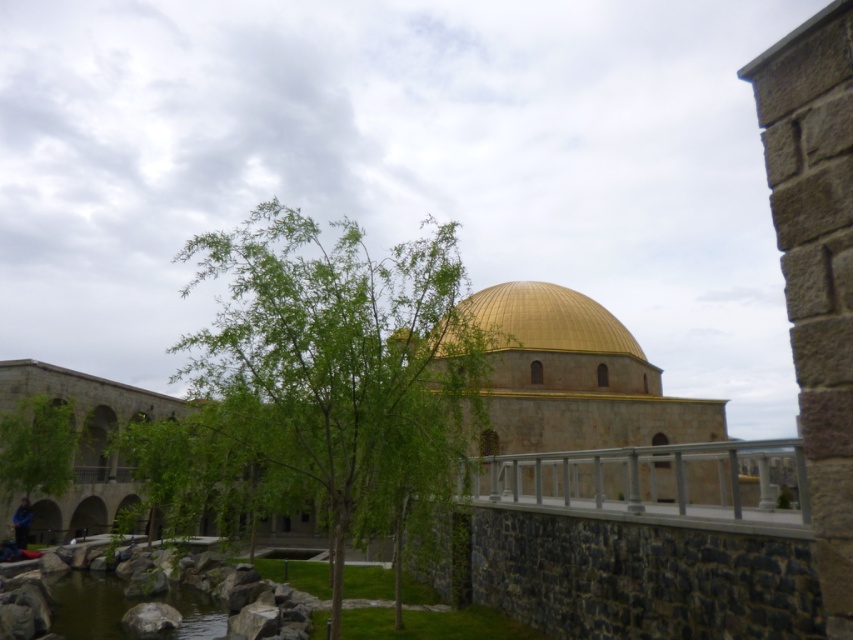
You are a photographer planning to capture the gold polished dome at center and the green leafy tree at center in a single shot. Given that the tree is partially blocking the dome, how might you adjust your position to ensure both are visible without obstruction?

The green leafy tree at center is much taller than the gold polished dome at center, so positioning yourself further back from the tree would allow you to angle the camera downward to include both the tree and the dome while minimizing the obstruction caused by the tree.

You are an architect visiting the historical site and want to take a photo of the gold polished dome at center without the green leafy tree at center blocking the view. Is the tree currently blocking the dome in the image?

The green leafy tree at center has a larger size compared to gold polished dome at center, so the tree is likely blocking the dome in the image.

You are a photographer planning to capture the golden dome of the mosque in the background. You notice the green water at lower left and the green leafy tree at lower left might block the view. Which object is larger and could potentially block more of the dome?

The green water at lower left is bigger than the green leafy tree at lower left, so it could potentially block more of the dome.